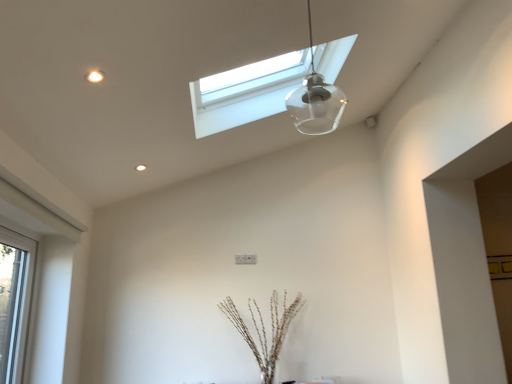
Question: Should I look upward or downward to see clear glass window at left, the 2th window in the top-to-bottom sequence?

Choices:
 (A) up
 (B) down

Answer: (B)

Question: Considering the relative positions of transparent glass window at upper center, arranged as the second window when viewed from the left, and transparent glass pendant light at upper center in the image provided, is transparent glass window at upper center, arranged as the second window when viewed from the left, behind transparent glass pendant light at upper center?

Choices:
 (A) yes
 (B) no

Answer: (A)

Question: Could you tell me if transparent glass window at upper center, which ranks as the first window in top-to-bottom order, is facing transparent glass pendant light at upper center?

Choices:
 (A) no
 (B) yes

Answer: (A)

Question: Can you confirm if transparent glass window at upper center, arranged as the second window when viewed from the left, is smaller than transparent glass pendant light at upper center?

Choices:
 (A) yes
 (B) no

Answer: (B)

Question: Is transparent glass window at upper center, arranged as the second window when viewed from the left, at the left side of transparent glass pendant light at upper center?

Choices:
 (A) no
 (B) yes

Answer: (B)

Question: From the image's perspective, is transparent glass window at upper center, arranged as the second window when viewed from the left, beneath transparent glass pendant light at upper center?

Choices:
 (A) yes
 (B) no

Answer: (B)

Question: Can you confirm if transparent glass window at upper center, the first window positioned from the right, is positioned to the right of transparent glass pendant light at upper center?

Choices:
 (A) yes
 (B) no

Answer: (B)

Question: From a real-world perspective, is transparent glass pendant light at upper center under brown textured sticks at center?

Choices:
 (A) yes
 (B) no

Answer: (B)

Question: Is transparent glass pendant light at upper center bigger than brown textured sticks at center?

Choices:
 (A) yes
 (B) no

Answer: (B)

Question: Is transparent glass pendant light at upper center placed right next to brown textured sticks at center?

Choices:
 (A) no
 (B) yes

Answer: (A)

Question: Can you confirm if transparent glass pendant light at upper center is thinner than brown textured sticks at center?

Choices:
 (A) yes
 (B) no

Answer: (A)

Question: Is transparent glass pendant light at upper center oriented towards brown textured sticks at center?

Choices:
 (A) yes
 (B) no

Answer: (B)

Question: From the image's perspective, does transparent glass pendant light at upper center appear higher than brown textured sticks at center?

Choices:
 (A) yes
 (B) no

Answer: (A)

Question: Are clear glass window at left, which is the 1th window from bottom to top, and brown textured sticks at center far apart?

Choices:
 (A) yes
 (B) no

Answer: (A)